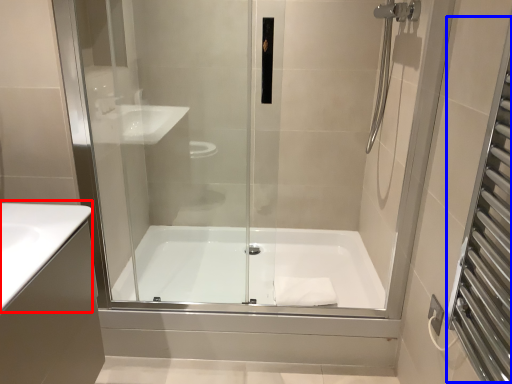
Question: Which object appears farthest to the camera in this image, counter top (highlighted by a red box) or screen door (highlighted by a blue box)?

Choices:
 (A) counter top
 (B) screen door

Answer: (A)